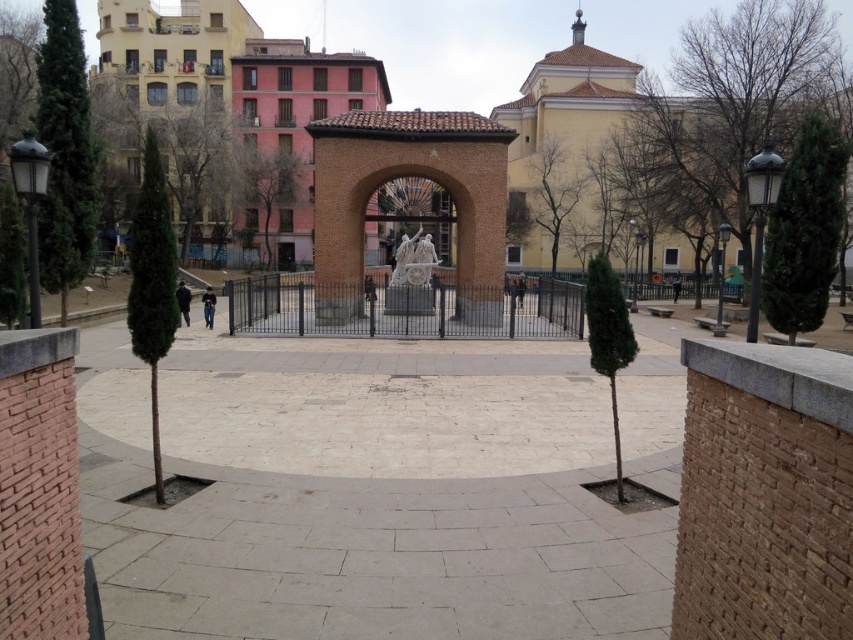
Locate an element on the screen. This screenshot has height=640, width=853. brown brick archway at center is located at coordinates (408, 176).

Which is in front, point (345, 205) or point (384, 244)?

Point (345, 205) is more forward.

This screenshot has width=853, height=640. I want to click on brown brick archway at center, so click(x=408, y=176).

Find the location of a particular element. The image size is (853, 640). brown brick archway at center is located at coordinates (408, 176).